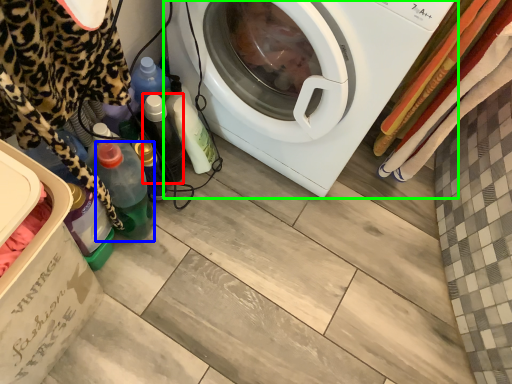
Question: Estimate the real-world distances between objects in this image. Which object is farther from bottle (highlighted by a red box), bottle (highlighted by a blue box) or washing machine (highlighted by a green box)?

Choices:
 (A) bottle
 (B) washing machine

Answer: (B)